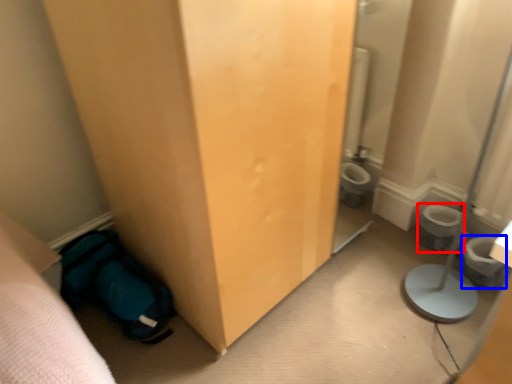
Question: Among these objects, which one is farthest to the camera, toilet bowl (highlighted by a red box) or potty (highlighted by a blue box)?

Choices:
 (A) toilet bowl
 (B) potty

Answer: (A)